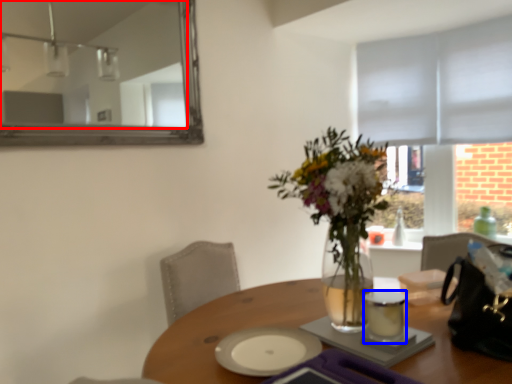
Question: Which point is further to the camera, mirror (highlighted by a red box) or tableware (highlighted by a blue box)?

Choices:
 (A) mirror
 (B) tableware

Answer: (A)